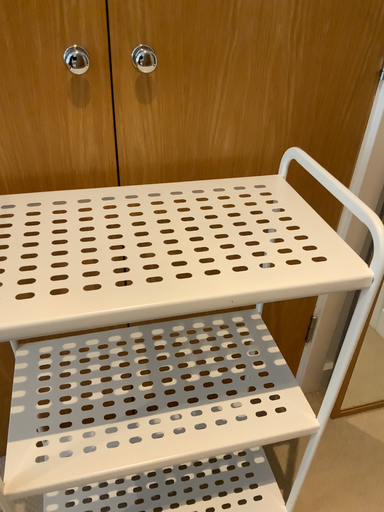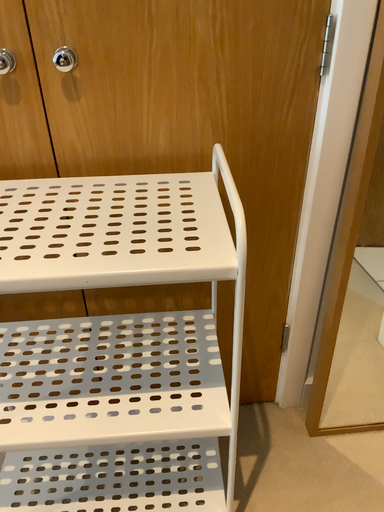
Question: How did the camera likely rotate when shooting the video?

Choices:
 (A) rotated right
 (B) rotated left

Answer: (B)